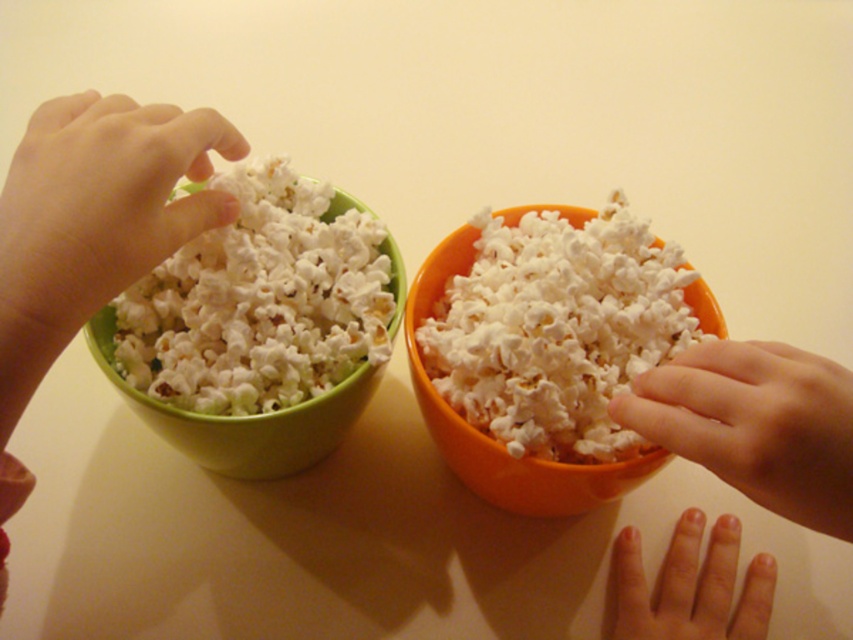
Question: Among these points, which one is nearest to the camera?

Choices:
 (A) (184, 204)
 (B) (843, 515)
 (C) (109, 218)
 (D) (640, 632)

Answer: (B)

Question: Estimate the real-world distances between objects in this image. Which object is farther from the white fluffy popcorn at left?

Choices:
 (A) white fluffy popcorn at right
 (B) smooth skin hand at right

Answer: (B)

Question: Does white fluffy popcorn at left have a greater width compared to smooth green bowl at left?

Choices:
 (A) no
 (B) yes

Answer: (B)

Question: Does white fluffy popcorn at left appear under smooth skin hand at center?

Choices:
 (A) no
 (B) yes

Answer: (A)

Question: Can you confirm if white fluffy popcorn at right is wider than matte white hand at left?

Choices:
 (A) no
 (B) yes

Answer: (B)

Question: Which object is positioned farthest from the white fluffy popcorn at left?

Choices:
 (A) white fluffy popcorn at right
 (B) matte white hand at left

Answer: (A)